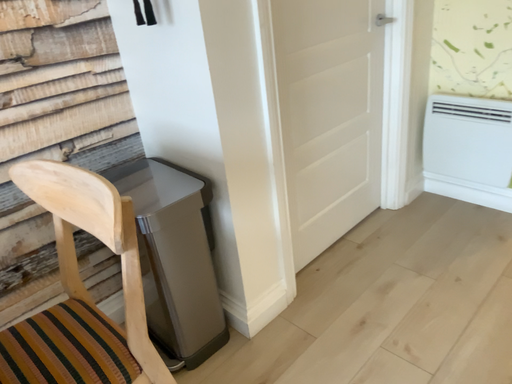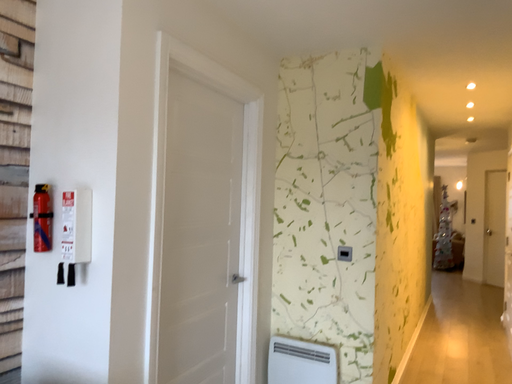
Question: Which way did the camera rotate in the video?

Choices:
 (A) rotated downward
 (B) rotated upward

Answer: (B)